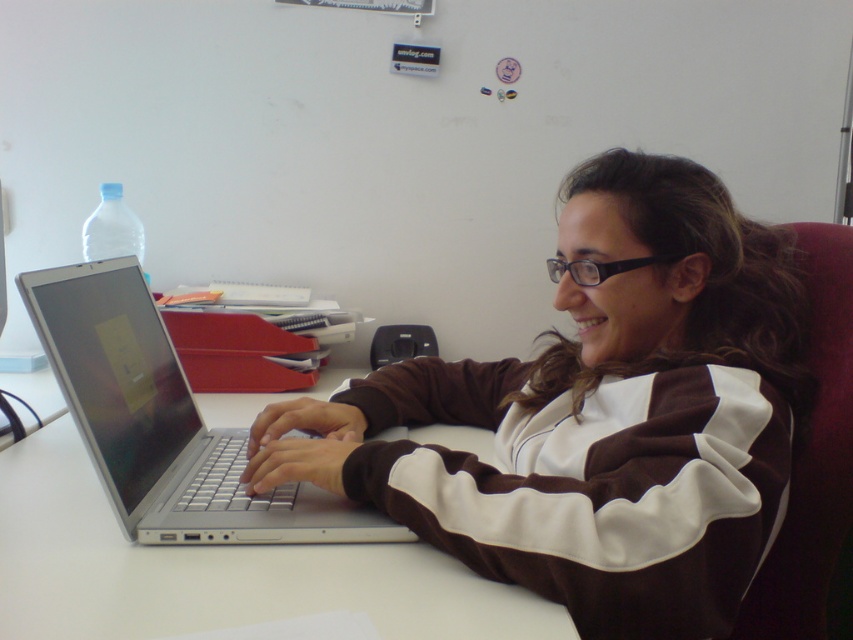
You need to place a new object on the desk. The object requires a space that is bigger than the silver metallic laptop at center. Is there enough space on the white smooth table at center for this object?

The white smooth table at center is larger in size than the silver metallic laptop at center, so there is enough space on the white smooth table at center to place the object requiring a space bigger than the laptop.